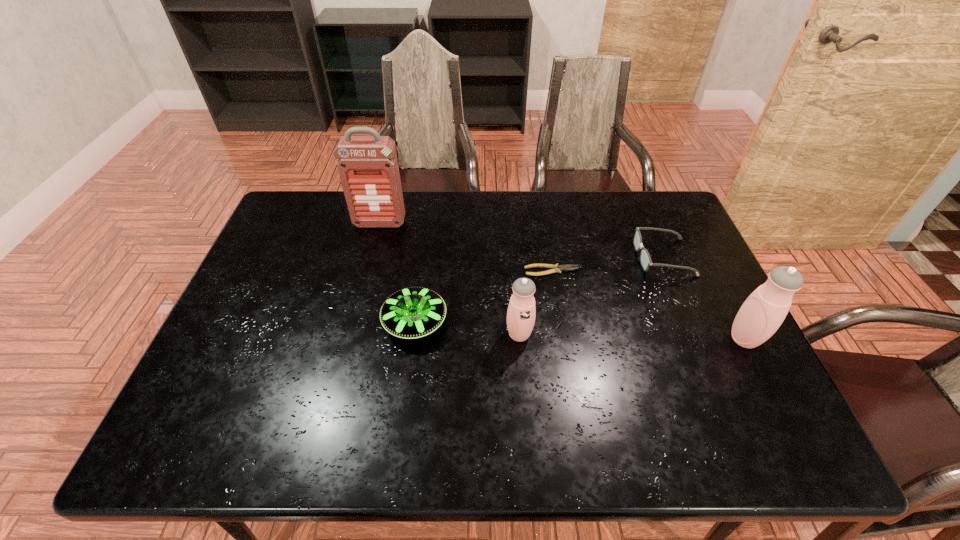
Please point a spot on the left to add another thermos bottle. Please provide its 2D coordinates. Your answer should be formatted as a tuple, i.e. [(x, y)], where the tuple contains the x and y coordinates of a point satisfying the conditions above.

[(299, 330)]